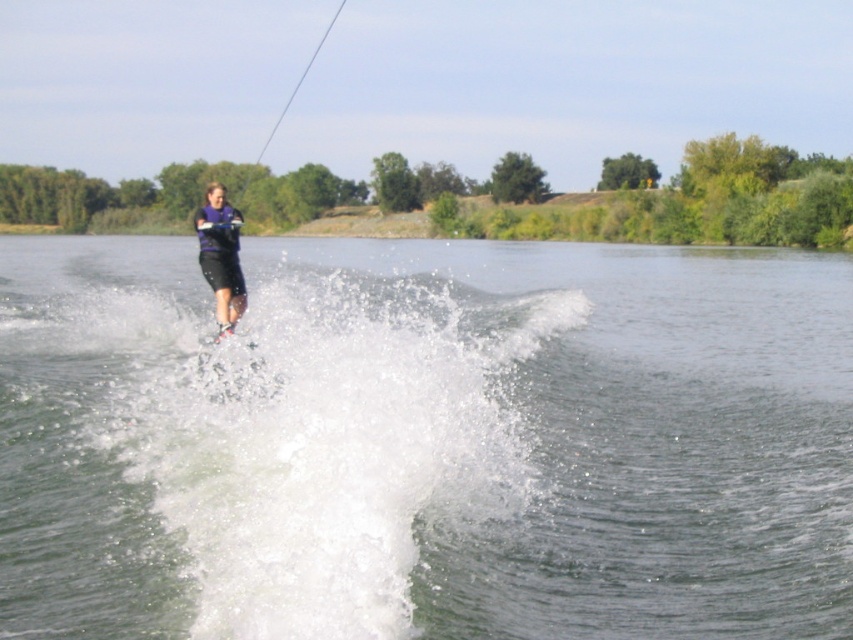
Based on the photo, you are a photographer trying to capture the perfect shot of the water skier. You notice two points in the scene labeled as point 1 at coordinates point (289, 592) and point 2 at coordinates point (239, 314). Which point is positioned closer to your camera lens?

Point (289, 592) is closer to the viewer than point (239, 314).

You are a safety officer assessing the water skiing area. You need to ensure the distance between the clear water at center and the purple matte shorts at center is at least 100 feet to prevent collisions with other boats. Is the current distance sufficient?

The clear water at center and purple matte shorts at center are 90.03 feet apart, which is less than the required 100 feet. Therefore, the current distance is not sufficient to prevent collisions with other boats.